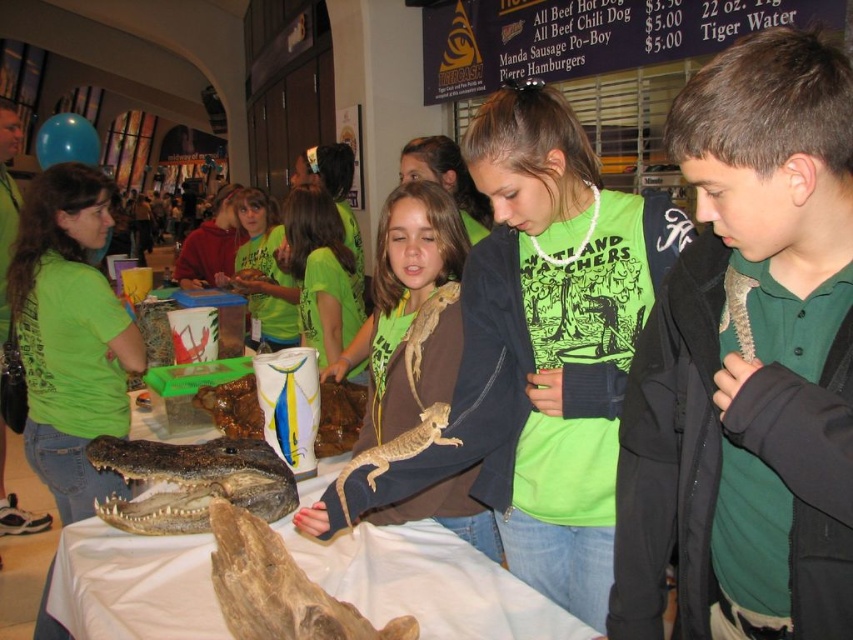
Question: Does green textured shirt at center appear under smooth beige lizard at center?

Choices:
 (A) no
 (B) yes

Answer: (A)

Question: Which of these objects is positioned farthest from the brown matte lizard at center?

Choices:
 (A) dark brown textured crocodile head at center
 (B) smooth beige lizard at center

Answer: (A)

Question: Considering the relative positions of brown matte lizard at center and dark brown textured crocodile head at center in the image provided, where is brown matte lizard at center located with respect to dark brown textured crocodile head at center?

Choices:
 (A) above
 (B) below

Answer: (A)

Question: Estimate the real-world distances between objects in this image. Which object is closer to the green textured shirt at center?

Choices:
 (A) brown matte lizard at center
 (B) smooth beige lizard at center

Answer: (B)

Question: Which is farther from the brown matte lizard at center?

Choices:
 (A) dark brown textured crocodile head at center
 (B) smooth beige lizard at center
 (C) green textured shirt at center

Answer: (C)

Question: Observing the image, what is the correct spatial positioning of green textured shirt at center in reference to dark brown textured crocodile head at center?

Choices:
 (A) left
 (B) right

Answer: (B)